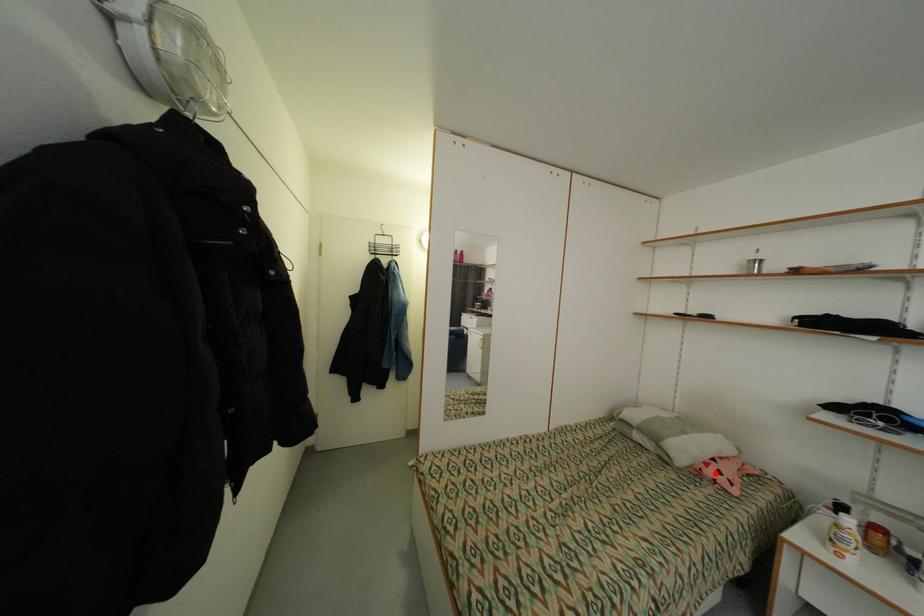
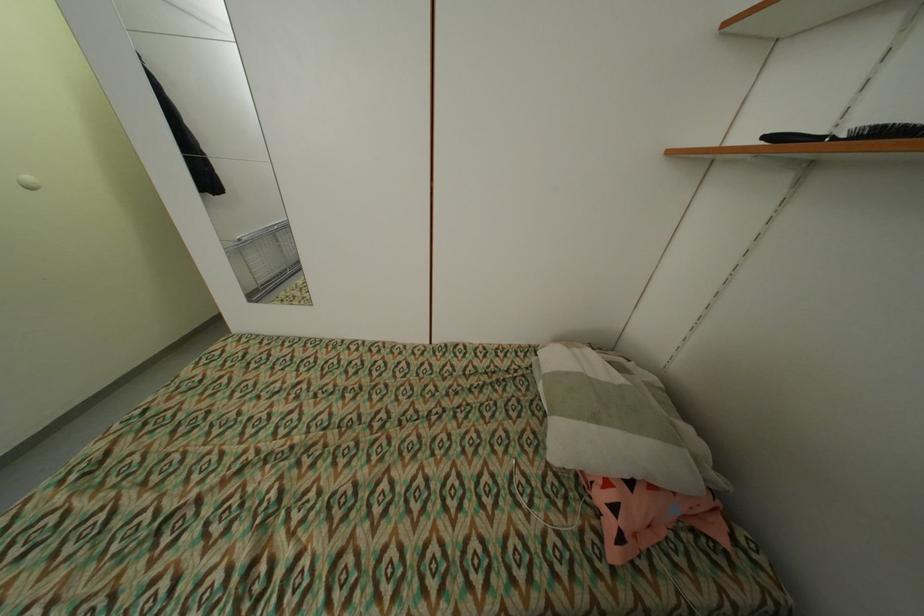
The point at the highlighted location is marked in the first image. Where is the corresponding point in the second image?

(606, 498)